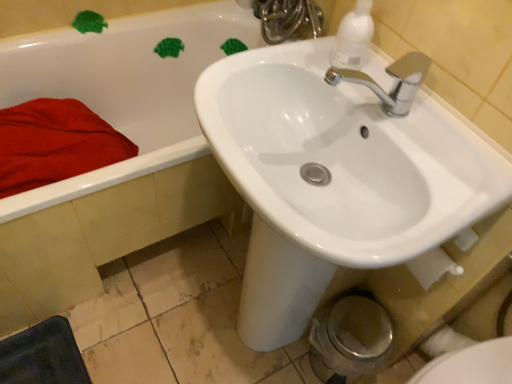
Question: Considering their positions, is white glossy bidet at lower right located in front of or behind white glossy faucet at upper center?

Choices:
 (A) front
 (B) behind

Answer: (A)

Question: From the image's perspective, is white glossy bidet at lower right above or below white glossy faucet at upper center?

Choices:
 (A) above
 (B) below

Answer: (B)

Question: Which of these objects is positioned closest to the white glossy faucet at upper center?

Choices:
 (A) white glossy bidet at lower right
 (B) white plastic soap dispenser at upper right
 (C) white glossy sink at upper center
 (D) red soft towel at left
 (E) white glossy bathtub at upper left

Answer: (E)

Question: Which object is the closest to the white glossy sink at upper center?

Choices:
 (A) white glossy bidet at lower right
 (B) red soft towel at left
 (C) white plastic soap dispenser at upper right
 (D) white glossy bathtub at upper left
 (E) white glossy faucet at upper center

Answer: (C)